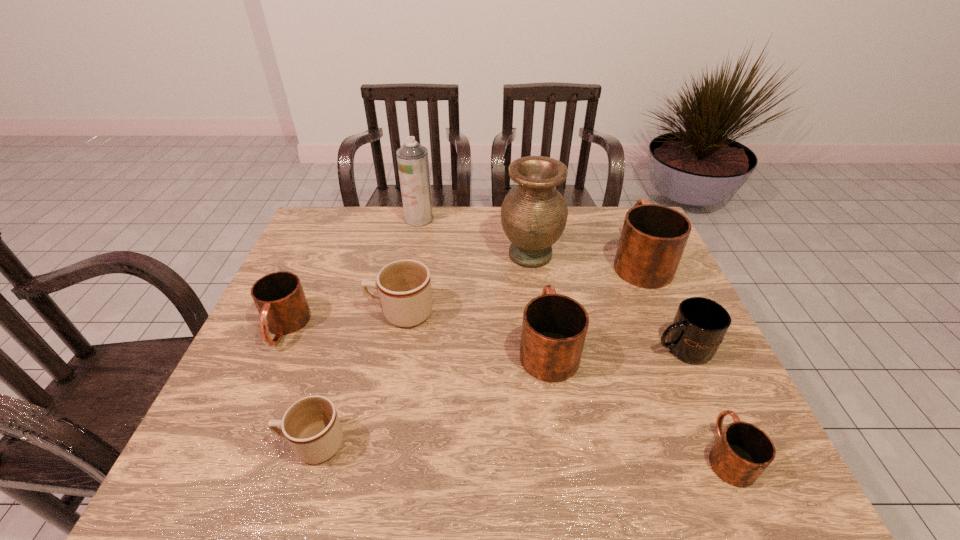
Locate an element on the screen. free space between the smaller brown mug and the black mug is located at coordinates (497, 396).

The height and width of the screenshot is (540, 960). I want to click on free area in between the smallest rust mug and the vase, so click(629, 354).

The image size is (960, 540). Identify the location of the eighth closest object relative to the fourth mug from right to left. (279, 297).

Select which object appears as the third closest to the vase. Please provide its 2D coordinates. Your answer should be formatted as a tuple, i.e. [(x, y)], where the tuple contains the x and y coordinates of a point satisfying the conditions above.

[(404, 286)]

You are a GUI agent. You are given a task and a screenshot of the screen. Output one action in this format:
    pyautogui.click(x=<x>, y=<y>)
    Task: Click on the mug that stands as the fifth closest to the farthest rust mug
    
    Given the screenshot: What is the action you would take?
    pyautogui.click(x=311, y=426)

What are the coordinates of `mug that is the closest one to the third biggest rust mug` in the screenshot? It's located at (404, 286).

Find the location of a particular element. The height and width of the screenshot is (540, 960). rust mug that can be found as the second closest to the smaller brown mug is located at coordinates (554, 327).

Choose which rust mug is the nearest neighbor to the fourth mug from right to left. Please provide its 2D coordinates. Your answer should be formatted as a tuple, i.e. [(x, y)], where the tuple contains the x and y coordinates of a point satisfying the conditions above.

[(653, 238)]

Find the location of a particular element. The width and height of the screenshot is (960, 540). free space that satisfies the following two spatial constraints: 1. on the side of the smaller brown mug with the handle; 2. on the left side of the farthest object is located at coordinates (381, 219).

This screenshot has width=960, height=540. Identify the location of vacant point that satisfies the following two spatial constraints: 1. on the side of the leftmost rust mug with the handle; 2. on the side of the nearer brown mug with the handle. (232, 444).